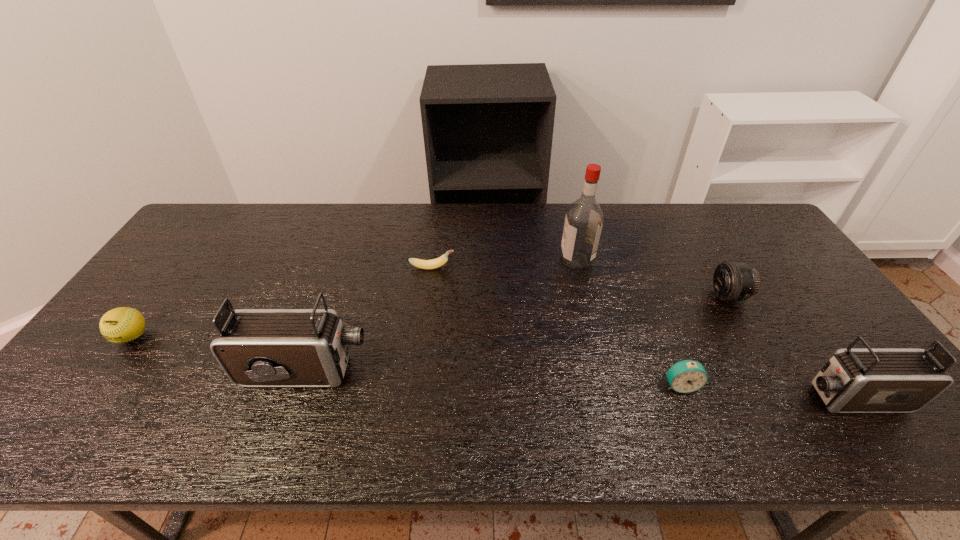
Where is `vacant space at the near edge of the desktop`? This screenshot has height=540, width=960. vacant space at the near edge of the desktop is located at coordinates (619, 393).

This screenshot has height=540, width=960. In order to click on vacant space at the left edge of the desktop in this screenshot , I will do `click(84, 367)`.

Find the location of a particular element. The image size is (960, 540). vacant space at the far right corner is located at coordinates (731, 233).

The width and height of the screenshot is (960, 540). In order to click on vacant area that lies between the left camcorder and the right camcorder in this screenshot , I will do `click(578, 384)`.

Locate an element on the screen. The height and width of the screenshot is (540, 960). vacant point located between the fifth nearest object and the shorter camcorder is located at coordinates (790, 347).

At what (x,y) coordinates should I click in order to perform the action: click on free space between the liquor and the third object from right to left. Please return your answer as a coordinate pair (x, y). This screenshot has width=960, height=540. Looking at the image, I should click on (629, 322).

I want to click on unoccupied position between the fourth object from right to left and the shortest object, so click(504, 263).

At what (x,y) coordinates should I click in order to perform the action: click on free space between the tallest object and the shorter camcorder. Please return your answer as a coordinate pair (x, y). Looking at the image, I should click on (714, 328).

Find the location of a particular element. The image size is (960, 540). free spot between the alarm clock and the banana is located at coordinates (556, 326).

Where is `vacant space that is in between the third object from right to left and the leftmost object`? The height and width of the screenshot is (540, 960). vacant space that is in between the third object from right to left and the leftmost object is located at coordinates (406, 361).